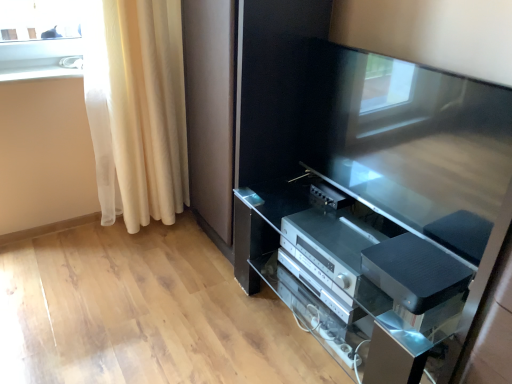
Find the location of `free region on the left part of white sheer curtain at left`. free region on the left part of white sheer curtain at left is located at coordinates pos(66,239).